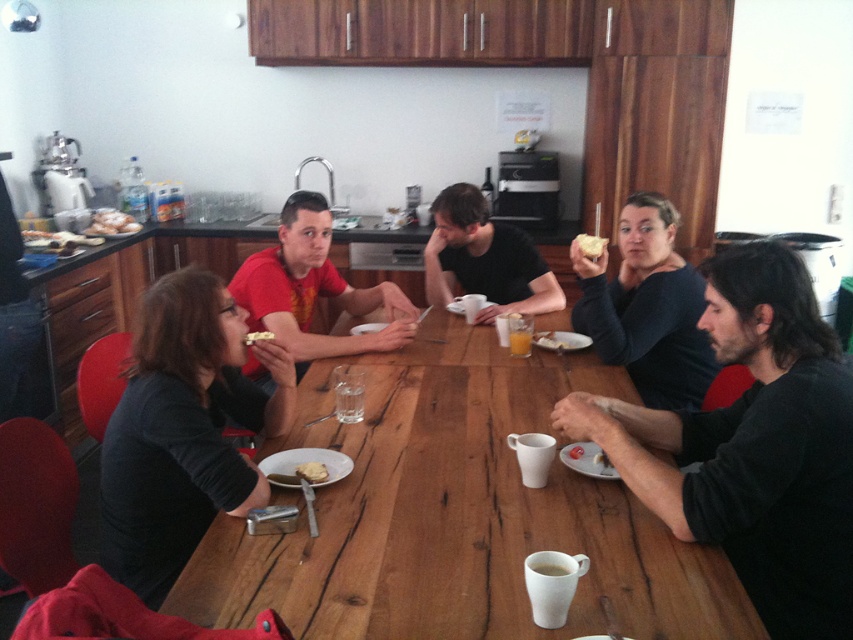
Based on the photo, you are a person who wants to reach the white ceramic mug at table center from where you are standing next to the matte black shirt at center. Can you comfortably grab it without moving your body?

The distance between the matte black shirt at center and the white ceramic mug at table center is 6.39 feet. Since this distance is greater than the typical arm reach of an average person, you would need to move closer to grab it.

You are at a party and want to place a small gift box on the table. You see the matte red shirt at center and the yellow cake at center. Which object can you place the gift box next to without it being covered?

The yellow cake at center is smaller than the matte red shirt at center, so placing the gift box next to the yellow cake at center would leave more space and prevent it from being covered.